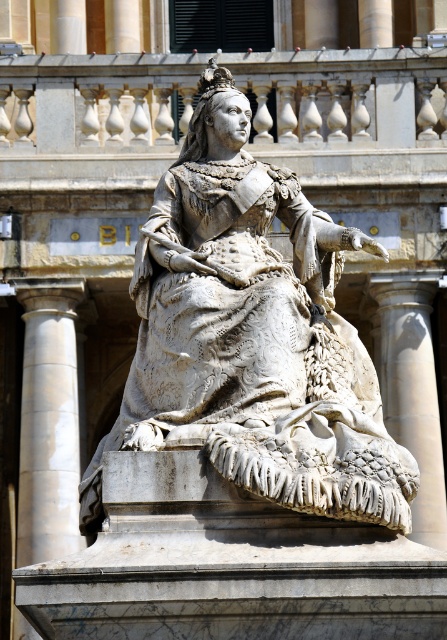
Between white marble column at left and white marble column at right, which one appears on the right side from the viewer's perspective?

Positioned to the right is white marble column at right.

Does white marble column at left have a greater height compared to white marble column at right?

Correct, white marble column at left is much taller as white marble column at right.

Does point (39, 323) come in front of point (431, 486)?

No, it is behind (431, 486).

The height and width of the screenshot is (640, 447). Identify the location of white marble column at left. (49, 420).

Is point (295, 436) positioned after point (371, 275)?

No.

Does white marble statue at center have a lesser height compared to white marble column at right?

No.

The height and width of the screenshot is (640, 447). What are the coordinates of `white marble statue at center` in the screenshot? It's located at (252, 337).

Which is below, white marble statue at center or white marble column at left?

white marble column at left is below.

Between point (164, 301) and point (47, 390), which one is positioned behind?

Point (47, 390)

I want to click on white marble statue at center, so click(x=252, y=337).